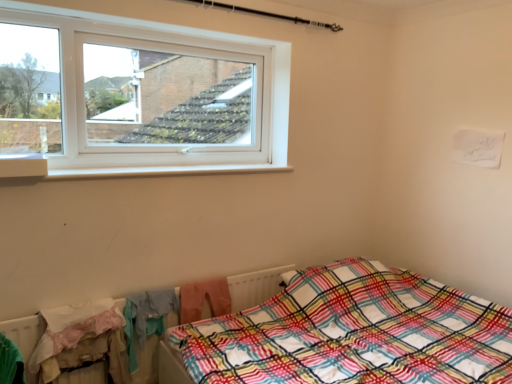
This screenshot has width=512, height=384. What do you see at coordinates (255, 286) in the screenshot? I see `white textured radiator at lower left` at bounding box center [255, 286].

At what (x,y) coordinates should I click in order to perform the action: click on white plastic window sill at upper left. Please return your answer as a coordinate pair (x, y). Image resolution: width=512 pixels, height=384 pixels. Looking at the image, I should click on (23, 165).

Describe the element at coordinates (348, 333) in the screenshot. The image size is (512, 384). I see `plaid fabric bed at lower right` at that location.

You are a GUI agent. You are given a task and a screenshot of the screen. Output one action in this format:
    pyautogui.click(x=<x>, y=<y>)
    Task: Click on the white textured radiator at lower left
    
    Given the screenshot: What is the action you would take?
    pyautogui.click(x=255, y=286)

Is plaid fabric bed at lower right located outside white textured radiator at lower left?

Yes, plaid fabric bed at lower right is located beyond the bounds of white textured radiator at lower left.

Is point (456, 317) closer to viewer compared to point (243, 274)?

Yes.

From a real-world perspective, is plaid fabric bed at lower right physically located above or below white textured radiator at lower left?

From a real-world perspective, plaid fabric bed at lower right is physically below white textured radiator at lower left.

Does white plastic window sill at upper left contain white textured radiator at lower left?

That's incorrect, white textured radiator at lower left is not inside white plastic window sill at upper left.

Is white plastic window sill at upper left in front of white textured radiator at lower left?

Yes.

From a real-world perspective, is white plastic window sill at upper left over white textured radiator at lower left?

Correct, in the physical world, white plastic window sill at upper left is higher than white textured radiator at lower left.

You are a GUI agent. You are given a task and a screenshot of the screen. Output one action in this format:
    pyautogui.click(x=<x>, y=<y>)
    Task: Click on the radiator behind the white plastic window sill at upper left
    The image size is (512, 384).
    Given the screenshot: What is the action you would take?
    pyautogui.click(x=255, y=286)

Is white plastic window sill at upper left located within white textured radiator at lower left?

That's incorrect, white plastic window sill at upper left is not inside white textured radiator at lower left.

From the image's perspective, is white textured radiator at lower left beneath white plastic window sill at upper left?

Yes.

From a real-world perspective, is white textured radiator at lower left above or below white plastic window sill at upper left?

In terms of real-world spatial position, white textured radiator at lower left is below white plastic window sill at upper left.

Does plaid fabric bed at lower right appear on the right side of white plastic window sill at upper left?

Correct, you'll find plaid fabric bed at lower right to the right of white plastic window sill at upper left.

From a real-world perspective, is plaid fabric bed at lower right physically below white plastic window sill at upper left?

Yes, from a real-world perspective, plaid fabric bed at lower right is beneath white plastic window sill at upper left.

Which of these two, plaid fabric bed at lower right or white plastic window sill at upper left, is wider?

With larger width is plaid fabric bed at lower right.

How different are the orientations of plaid fabric bed at lower right and white plastic window sill at upper left in degrees?

90.4 degrees separate the facing orientations of plaid fabric bed at lower right and white plastic window sill at upper left.

Does white plastic window sill at upper left have a greater width compared to plaid fabric bed at lower right?

Incorrect, the width of white plastic window sill at upper left does not surpass that of plaid fabric bed at lower right.

Is white plastic window sill at upper left taller than plaid fabric bed at lower right?

No, white plastic window sill at upper left is not taller than plaid fabric bed at lower right.

Which of these two, white plastic window sill at upper left or plaid fabric bed at lower right, is bigger?

plaid fabric bed at lower right is bigger.

Which point is more forward, (29, 344) or (499, 370)?

The point (29, 344) is closer.

Does white textured radiator at lower left have a greater height compared to plaid fabric bed at lower right?

Incorrect, the height of white textured radiator at lower left is not larger of that of plaid fabric bed at lower right.

Choose the correct answer: Is white textured radiator at lower left inside plaid fabric bed at lower right or outside it?

white textured radiator at lower left is located beyond the bounds of plaid fabric bed at lower right.

Where is `radiator above the plaid fabric bed at lower right (from the image's perspective)`? The width and height of the screenshot is (512, 384). radiator above the plaid fabric bed at lower right (from the image's perspective) is located at coordinates (255, 286).

The width and height of the screenshot is (512, 384). I want to click on radiator lying on the right of white plastic window sill at upper left, so 255,286.

When comparing their distances from white textured radiator at lower left, does plaid fabric bed at lower right or white plastic window sill at upper left seem closer?

plaid fabric bed at lower right is closer to white textured radiator at lower left.

Considering their positions, is white plastic window sill at upper left positioned further to white textured radiator at lower left than plaid fabric bed at lower right?

Based on the image, white plastic window sill at upper left appears to be further to white textured radiator at lower left.

When comparing their distances from plaid fabric bed at lower right, does white plastic window sill at upper left or white textured radiator at lower left seem closer?

white textured radiator at lower left is closer to plaid fabric bed at lower right.

When comparing their distances from white plastic window sill at upper left, does plaid fabric bed at lower right or white textured radiator at lower left seem further?

The object further to white plastic window sill at upper left is plaid fabric bed at lower right.

Based on their spatial positions, is white textured radiator at lower left or plaid fabric bed at lower right further from white plastic window sill at upper left?

Based on the image, plaid fabric bed at lower right appears to be further to white plastic window sill at upper left.

In the scene shown: Based on their spatial positions, is white textured radiator at lower left or white plastic window sill at upper left closer to plaid fabric bed at lower right?

Based on the image, white textured radiator at lower left appears to be nearer to plaid fabric bed at lower right.

At what (x,y) coordinates should I click in order to perform the action: click on radiator between white plastic window sill at upper left and plaid fabric bed at lower right in the horizontal direction. Please return your answer as a coordinate pair (x, y). This screenshot has width=512, height=384. Looking at the image, I should click on (255, 286).